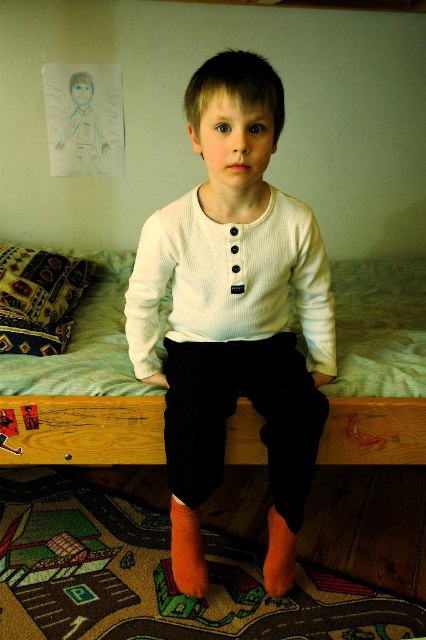
Question: Can you confirm if white ribbed shirt at center is bigger than white ribbed sweater at center?

Choices:
 (A) yes
 (B) no

Answer: (A)

Question: Does white ribbed shirt at center lie in front of wooden bed at center?

Choices:
 (A) yes
 (B) no

Answer: (A)

Question: Which of the following is the closest to the observer?

Choices:
 (A) (176, 547)
 (B) (258, 285)

Answer: (B)

Question: Which point is closer to the camera?

Choices:
 (A) (213, 284)
 (B) (111, 417)
 (C) (310, 216)

Answer: (C)

Question: Which object is closer to the camera taking this photo?

Choices:
 (A) white ribbed shirt at center
 (B) wooden bed at center

Answer: (A)

Question: In this image, where is white ribbed shirt at center located relative to wooden bed at center?

Choices:
 (A) right
 (B) left

Answer: (B)